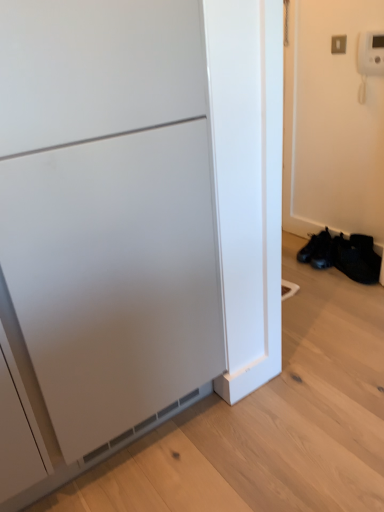
Question: Looking at their shapes, would you say matte white cabinet at left is wider or thinner than black mesh shoe at lower right?

Choices:
 (A) thin
 (B) wide

Answer: (B)

Question: Considering the positions of point (18, 154) and point (337, 237), is point (18, 154) closer or farther from the camera than point (337, 237)?

Choices:
 (A) farther
 (B) closer

Answer: (B)

Question: Which object is positioned farthest from the black leather shoes at lower right?

Choices:
 (A) matte white cabinet at left
 (B) black mesh shoe at lower right

Answer: (A)

Question: Based on their relative distances, which object is nearer to the black leather shoes at lower right?

Choices:
 (A) black mesh shoe at lower right
 (B) matte white cabinet at left

Answer: (A)